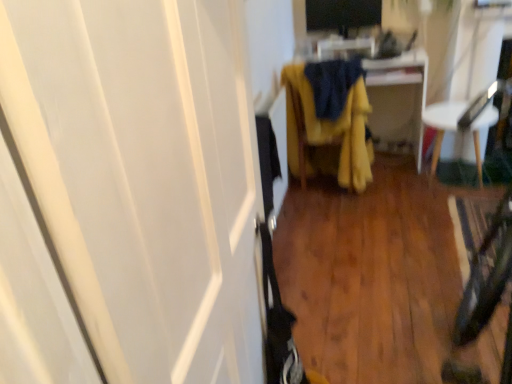
Question: Considering the positions of white glossy screen door at left and yellow fabric chair at center, which is the second furniture in right-to-left order, in the image, is white glossy screen door at left taller or shorter than yellow fabric chair at center, which is the second furniture in right-to-left order,?

Choices:
 (A) tall
 (B) short

Answer: (A)

Question: From the image's perspective, relative to yellow fabric chair at center, which is the second furniture in right-to-left order, is white glossy screen door at left above or below?

Choices:
 (A) above
 (B) below

Answer: (B)

Question: Estimate the real-world distances between objects in this image. Which object is farther from the yellow fabric at center?

Choices:
 (A) black glossy monitor at upper center
 (B) yellow fabric chair at center, which appears as the first furniture when viewed from the left
 (C) white plastic chair at right, which is the 2th furniture from left to right
 (D) white glossy screen door at left

Answer: (D)

Question: Estimate the real-world distances between objects in this image. Which object is farther from the yellow fabric at center?

Choices:
 (A) yellow fabric chair at center, which appears as the first furniture when viewed from the left
 (B) black glossy monitor at upper center
 (C) white glossy screen door at left
 (D) white plastic chair at right, which is the first furniture in right-to-left order

Answer: (C)